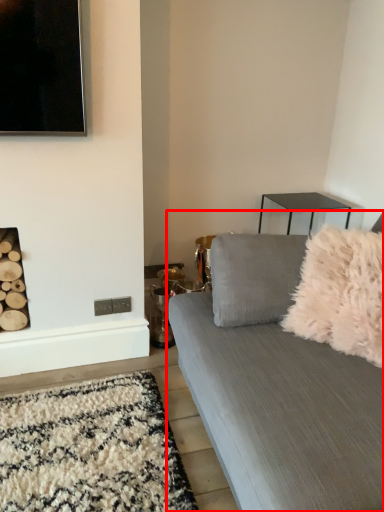
Question: Where is studio couch (annotated by the red box) located in relation to throw pillow in the image?

Choices:
 (A) left
 (B) right

Answer: (B)